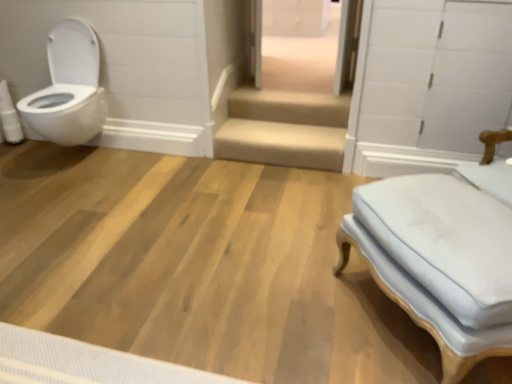
At what (x,y) coordinates should I click in order to perform the action: click on white fabric ottoman at right. Please return your answer as a coordinate pair (x, y). Looking at the image, I should click on pyautogui.click(x=443, y=253).

You are a GUI agent. You are given a task and a screenshot of the screen. Output one action in this format:
    pyautogui.click(x=<x>, y=<y>)
    Task: Click on the white fabric ottoman at right
    The width and height of the screenshot is (512, 384).
    Given the screenshot: What is the action you would take?
    pyautogui.click(x=443, y=253)

Is white glossy drawer at upper center spatially inside white glossy toilet at left, or outside of it?

white glossy drawer at upper center is not inside white glossy toilet at left, it's outside.

This screenshot has height=384, width=512. I want to click on drawer lying behind the white glossy toilet at left, so pos(295,17).

Is white glossy drawer at upper center positioned with its back to white glossy toilet at left?

white glossy drawer at upper center does not have its back to white glossy toilet at left.

From the image's perspective, between white glossy drawer at upper center and white glossy toilet at left, which one is located above?

white glossy drawer at upper center is shown above in the image.

Considering the points (504, 355) and (318, 9), which point is behind, point (504, 355) or point (318, 9)?

The point (318, 9) is behind.

You are a GUI agent. You are given a task and a screenshot of the screen. Output one action in this format:
    pyautogui.click(x=<x>, y=<y>)
    Task: Click on the furniture below the white glossy drawer at upper center (from the image's perspective)
    Image resolution: width=512 pixels, height=384 pixels.
    Given the screenshot: What is the action you would take?
    pyautogui.click(x=443, y=253)

From the image's perspective, which one is positioned lower, white fabric ottoman at right or white glossy drawer at upper center?

white fabric ottoman at right.

Considering the positions of objects white fabric ottoman at right and white glossy drawer at upper center in the image provided, who is behind, white fabric ottoman at right or white glossy drawer at upper center?

white glossy drawer at upper center is behind.

Would you say white glossy drawer at upper center is outside white fabric ottoman at right?

Absolutely, white glossy drawer at upper center is external to white fabric ottoman at right.

Is point (298, 32) in front of point (415, 217)?

That is False.

Considering their positions, is white glossy drawer at upper center located in front of or behind white fabric ottoman at right?

In the image, white glossy drawer at upper center appears behind white fabric ottoman at right.

Locate an element on the screen. Image resolution: width=512 pixels, height=384 pixels. furniture that appears on the right of white glossy drawer at upper center is located at coordinates (443, 253).

Can you confirm if white glossy toilet at left is positioned to the left of white glossy drawer at upper center?

Indeed, white glossy toilet at left is positioned on the left side of white glossy drawer at upper center.

Is the depth of white glossy toilet at left greater than that of white glossy drawer at upper center?

No.

Can you confirm if white glossy toilet at left is taller than white glossy drawer at upper center?

Indeed, white glossy toilet at left has a greater height compared to white glossy drawer at upper center.

The width and height of the screenshot is (512, 384). In order to click on furniture on the right of white glossy toilet at left in this screenshot , I will do `click(443, 253)`.

Is white glossy toilet at left touching white fabric ottoman at right?

No, white glossy toilet at left is not making contact with white fabric ottoman at right.

Considering the sizes of white glossy toilet at left and white fabric ottoman at right in the image, is white glossy toilet at left wider or thinner than white fabric ottoman at right?

Clearly, white glossy toilet at left has more width compared to white fabric ottoman at right.

Which object is closer to the camera taking this photo, white glossy toilet at left or white fabric ottoman at right?

white fabric ottoman at right.

Considering their positions, is white fabric ottoman at right located in front of or behind white glossy toilet at left?

Visually, white fabric ottoman at right is located in front of white glossy toilet at left.

From the picture: Can you see white fabric ottoman at right touching white glossy toilet at left?

No, white fabric ottoman at right is not next to white glossy toilet at left.

Does white fabric ottoman at right have a lesser height compared to white glossy toilet at left?

Yes, white fabric ottoman at right is shorter than white glossy toilet at left.

Which is more to the left, white fabric ottoman at right or white glossy toilet at left?

white glossy toilet at left.

Where is `toilet on the left of white glossy drawer at upper center`? The image size is (512, 384). toilet on the left of white glossy drawer at upper center is located at coordinates (69, 88).

Where is `drawer that is behind the white fabric ottoman at right`? drawer that is behind the white fabric ottoman at right is located at coordinates (295, 17).

Based on their spatial positions, is white glossy toilet at left or white fabric ottoman at right further from white glossy drawer at upper center?

white fabric ottoman at right is positioned further to the anchor white glossy drawer at upper center.

Estimate the real-world distances between objects in this image. Which object is further from white glossy toilet at left, white fabric ottoman at right or white glossy drawer at upper center?

white glossy drawer at upper center.

When comparing their distances from white fabric ottoman at right, does white glossy drawer at upper center or white glossy toilet at left seem further?

Result: The object further to white fabric ottoman at right is white glossy drawer at upper center.

Looking at the image, which one is located closer to white glossy drawer at upper center, white fabric ottoman at right or white glossy toilet at left?

white glossy toilet at left.

Based on their spatial positions, is white glossy toilet at left or white glossy drawer at upper center further from white fabric ottoman at right?

white glossy drawer at upper center is positioned further to the anchor white fabric ottoman at right.

Based on their spatial positions, is white glossy drawer at upper center or white fabric ottoman at right further from white glossy toilet at left?

The object further to white glossy toilet at left is white glossy drawer at upper center.

Image resolution: width=512 pixels, height=384 pixels. Identify the location of toilet between white fabric ottoman at right and white glossy drawer at upper center along the z-axis. (69, 88).